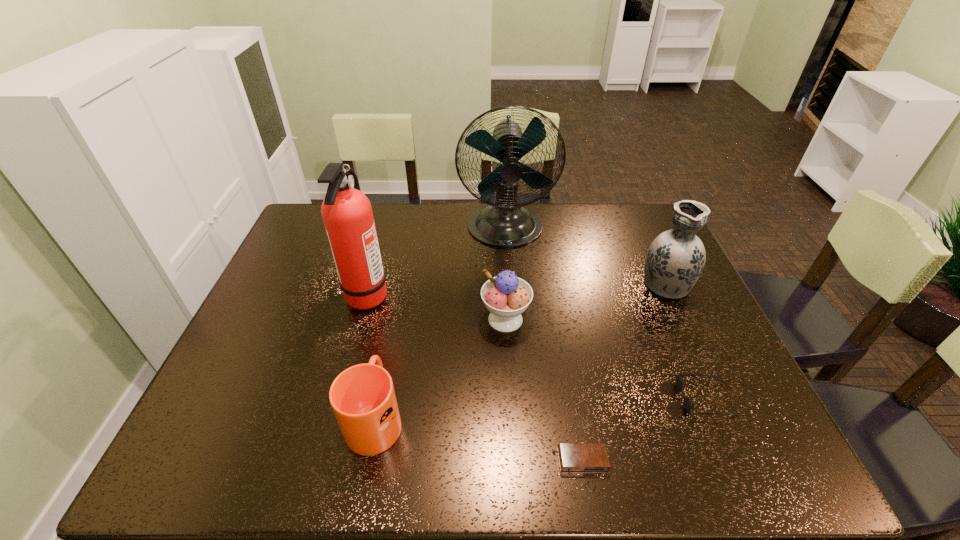
This screenshot has width=960, height=540. Find the location of `mug present at the near edge`. mug present at the near edge is located at coordinates (363, 399).

Locate an element on the screen. The image size is (960, 540). alarm clock that is positioned at the near edge is located at coordinates (573, 457).

I want to click on vase located at the right edge, so click(x=676, y=258).

Locate an element on the screen. sunglasses that is positioned at the right edge is located at coordinates (688, 403).

This screenshot has height=540, width=960. I want to click on vacant space at the far edge of the desktop, so click(566, 214).

Where is `vacant space at the near edge`? vacant space at the near edge is located at coordinates coord(654,458).

Locate an element on the screen. This screenshot has width=960, height=540. free space at the left edge of the desktop is located at coordinates (270, 401).

In the image, there is a desktop. Identify the location of blank space at the right edge. (686, 340).

Image resolution: width=960 pixels, height=540 pixels. In the image, there is a desktop. In order to click on vacant space at the far right corner in this screenshot , I will do `click(646, 226)`.

Where is `free spot between the mug and the vase`? free spot between the mug and the vase is located at coordinates (520, 350).